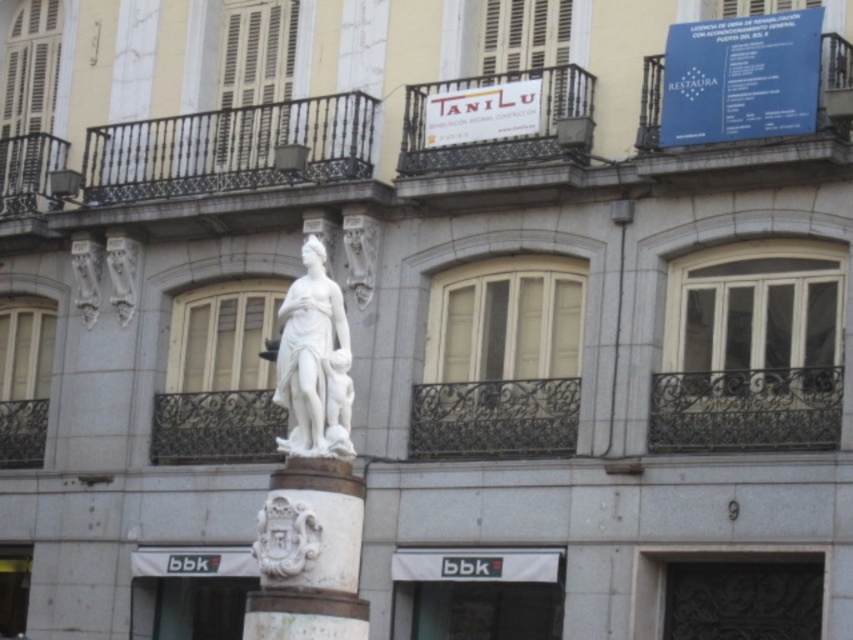
Question: Which point is farther from the camera taking this photo?

Choices:
 (A) (335, 433)
 (B) (289, 456)

Answer: (B)

Question: Which point is closer to the camera?

Choices:
 (A) (321, 538)
 (B) (343, 419)

Answer: (A)

Question: Is white stone column at center to the left of white marble statue at center from the viewer's perspective?

Choices:
 (A) yes
 (B) no

Answer: (A)

Question: Can you confirm if white stone column at center is wider than white marble statue at center?

Choices:
 (A) no
 (B) yes

Answer: (B)

Question: Is white stone column at center thinner than white marble statue at center?

Choices:
 (A) no
 (B) yes

Answer: (A)